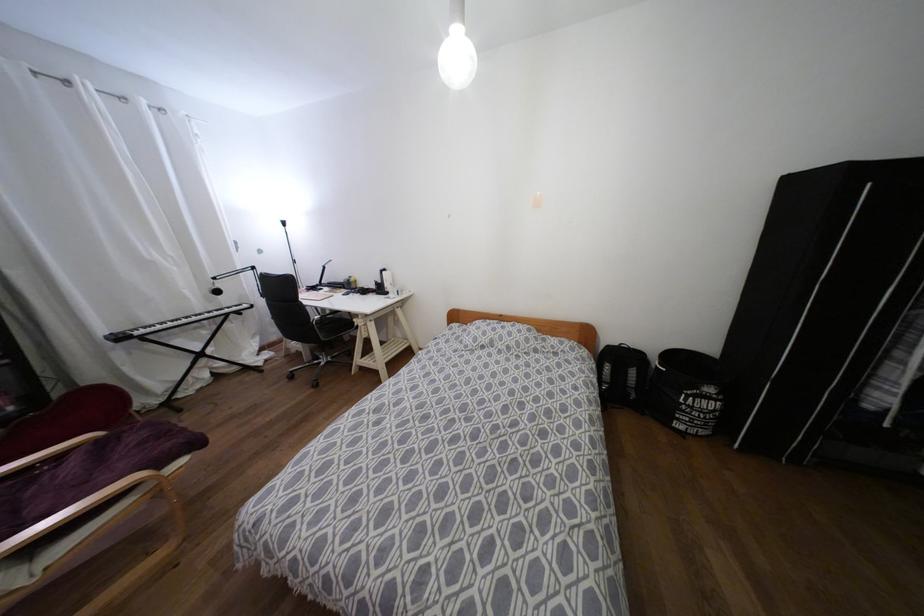
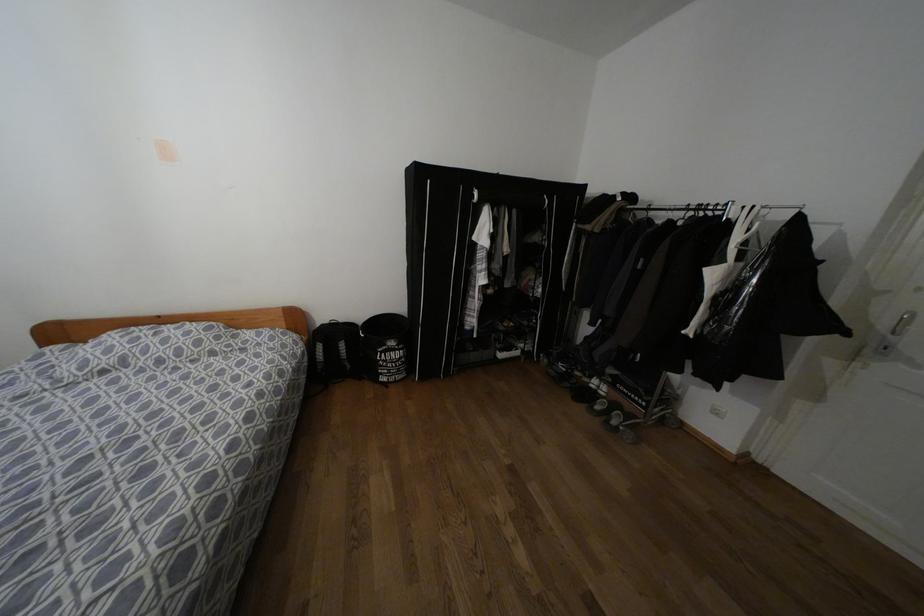
Find the pixel in the second image that matches (x=631, y=371) in the first image.

(342, 345)